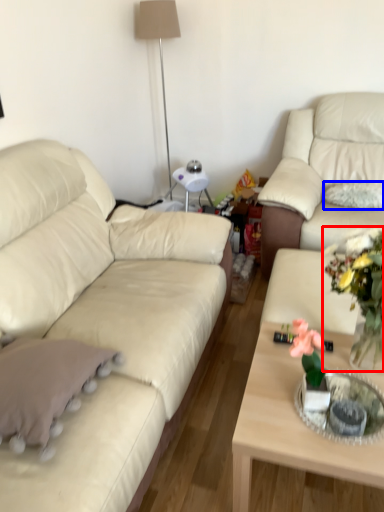
Question: Which of the following is the farthest to the observer, floral arrangement (highlighted by a red box) or pillow (highlighted by a blue box)?

Choices:
 (A) floral arrangement
 (B) pillow

Answer: (B)